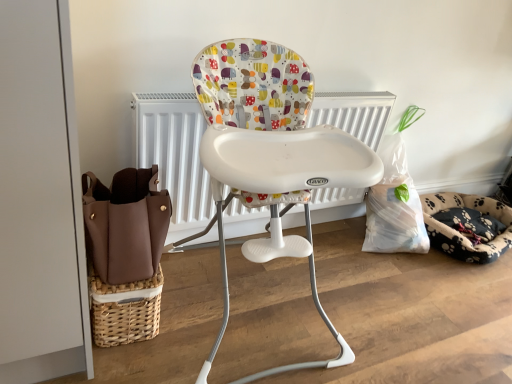
Locate an element on the screen. The width and height of the screenshot is (512, 384). vacant point to the right of white plastic highchair at center is located at coordinates (393, 328).